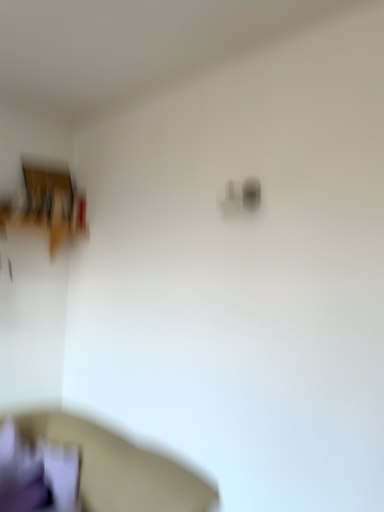
Question: Should I look upward or downward to see purple fabric cushion at lower left?

Choices:
 (A) up
 (B) down

Answer: (B)